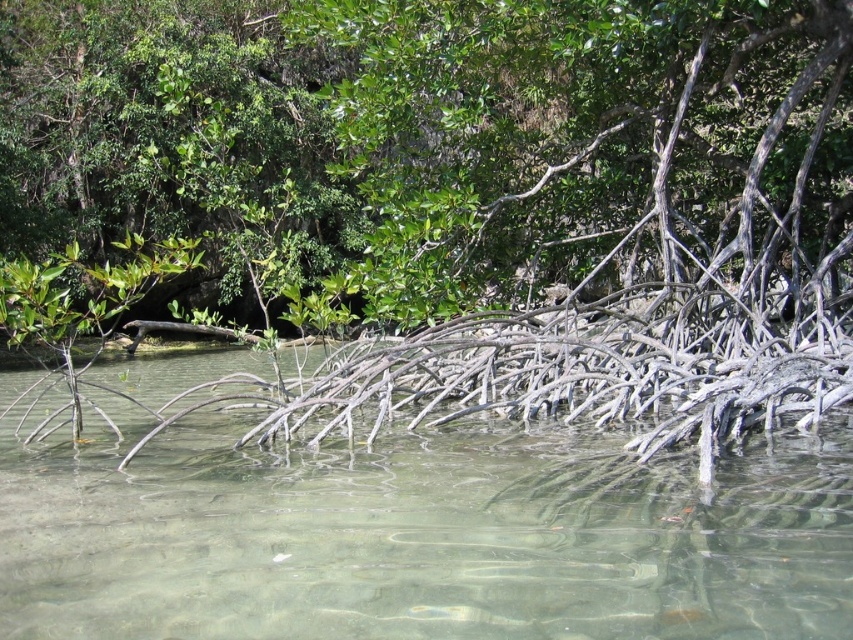
Question: Is green leafy tree at upper center to the right of clear water at center from the viewer's perspective?

Choices:
 (A) yes
 (B) no

Answer: (B)

Question: Observing the image, what is the correct spatial positioning of green leafy tree at upper center in reference to clear water at center?

Choices:
 (A) left
 (B) right

Answer: (A)

Question: Which of the following is the farthest from the observer?

Choices:
 (A) (62, 67)
 (B) (798, 513)

Answer: (A)

Question: Which point is farther from the camera taking this photo?

Choices:
 (A) (554, 164)
 (B) (543, 476)

Answer: (A)

Question: Is the position of green leafy tree at upper center less distant than that of clear water at center?

Choices:
 (A) no
 (B) yes

Answer: (A)